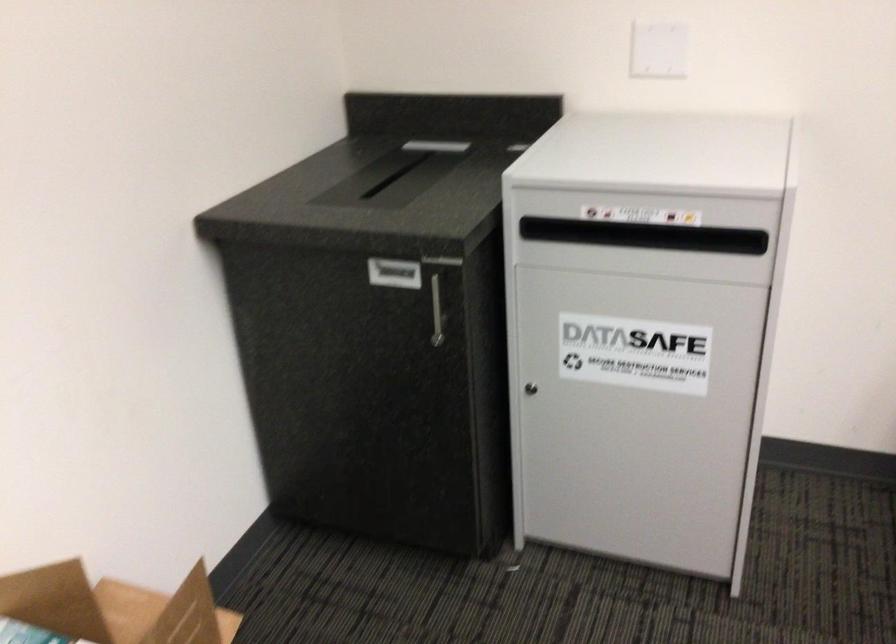
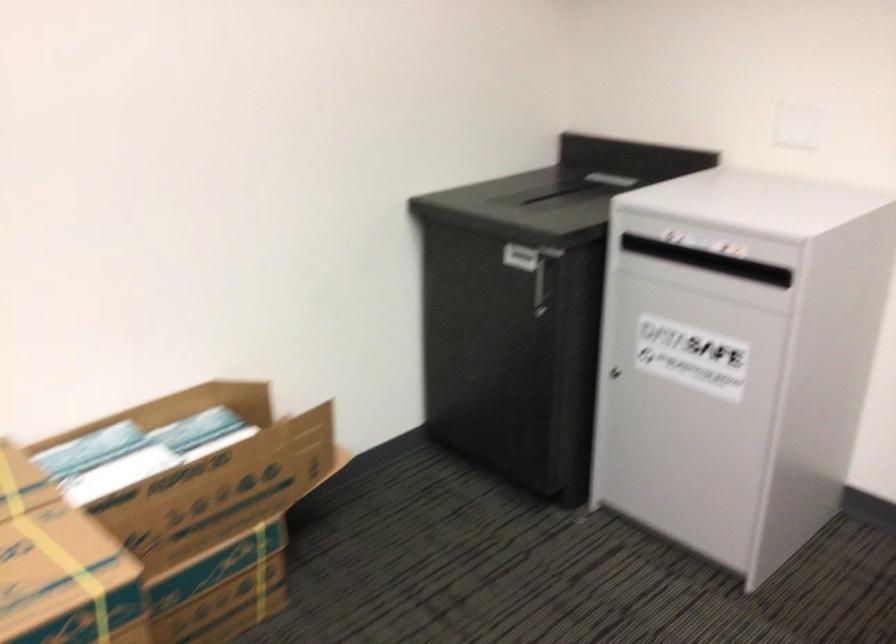
The point at (441, 299) is marked in the first image. Where is the corresponding point in the second image?

(541, 281)